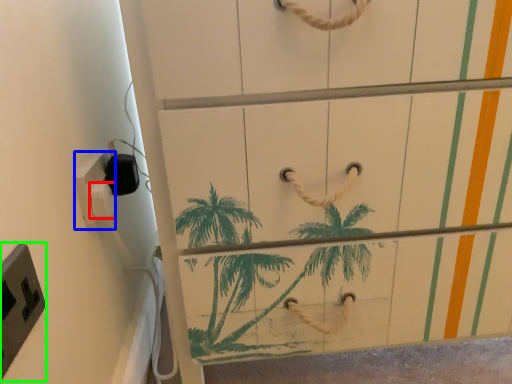
Question: Which object is the farthest from light switch (highlighted by a red box)? Choose among these: light switch (highlighted by a blue box) or light switch (highlighted by a green box).

Choices:
 (A) light switch
 (B) light switch

Answer: (B)